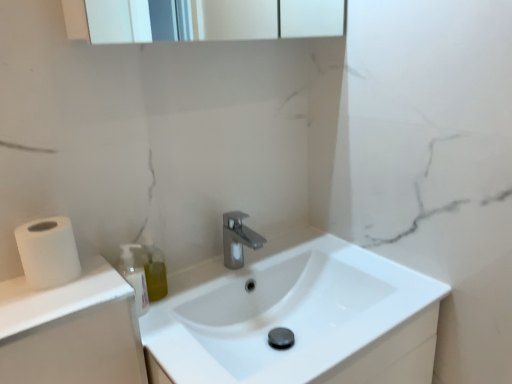
I want to click on vacant space behind satin nickel faucet at center, so click(x=266, y=243).